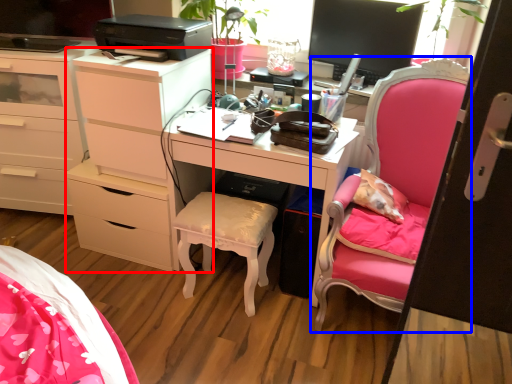
Question: Among these objects, which one is farthest to the camera, chest of drawers (highlighted by a red box) or chair (highlighted by a blue box)?

Choices:
 (A) chest of drawers
 (B) chair

Answer: (A)